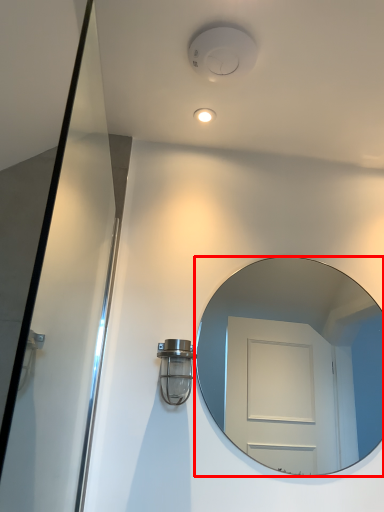
Question: From the image's perspective, considering the relative positions of mirror (annotated by the red box) and light fixture in the image provided, where is mirror (annotated by the red box) located with respect to the staircase?

Choices:
 (A) below
 (B) above

Answer: (B)